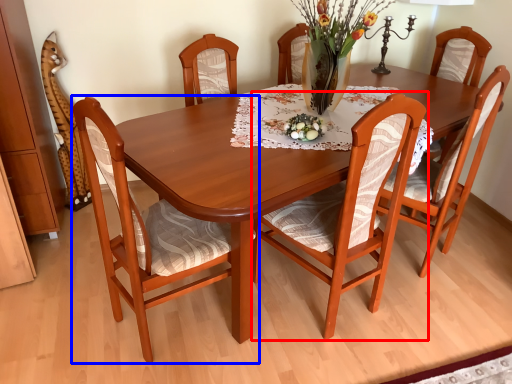
Question: Which of the following is the farthest to the observer, chair (highlighted by a red box) or chair (highlighted by a blue box)?

Choices:
 (A) chair
 (B) chair

Answer: (A)